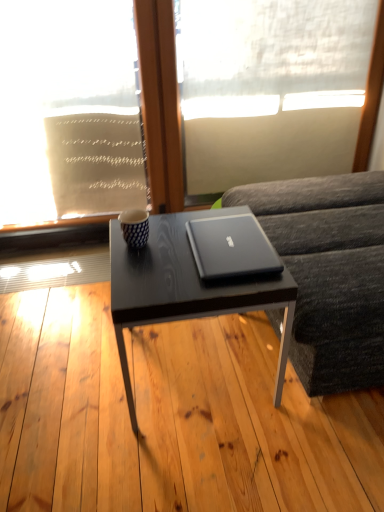
Locate an element on the screen. The height and width of the screenshot is (512, 384). empty space that is ontop of matte black coffee table at center (from a real-world perspective) is located at coordinates (184, 248).